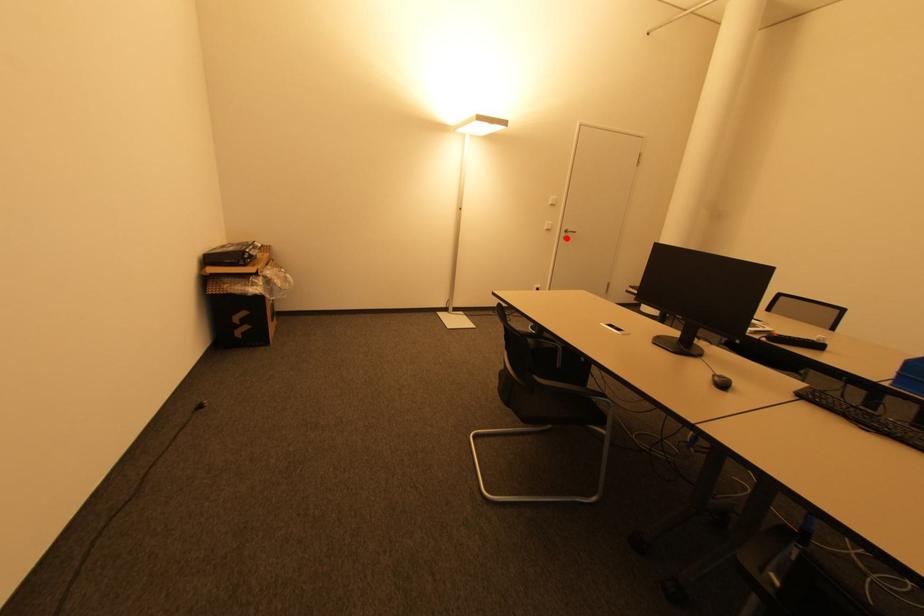
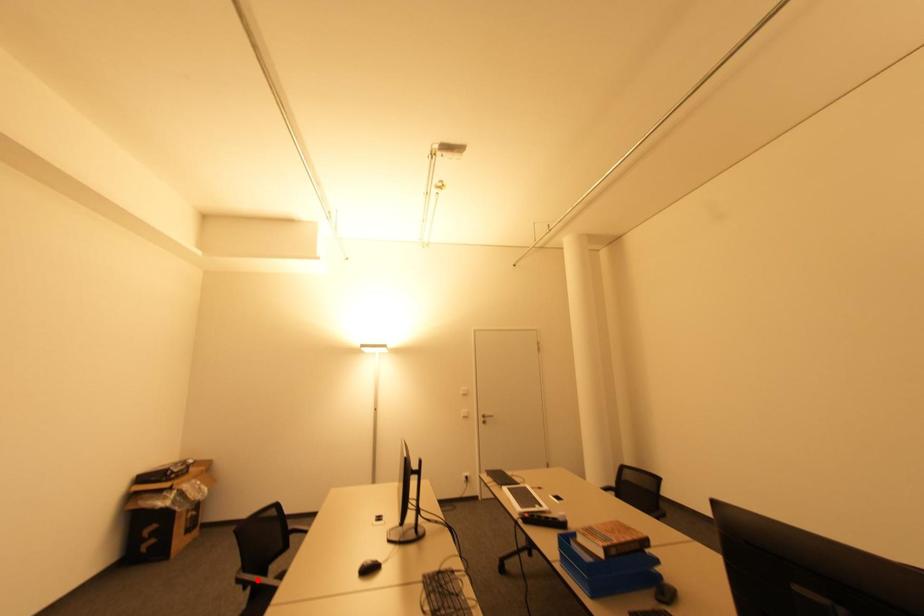
I am providing you with two images of the same scene from different viewpoints. A red point is marked on the first image and another point is marked on the second image. Does the point marked in image1 correspond to the same location as the one in image2?

No